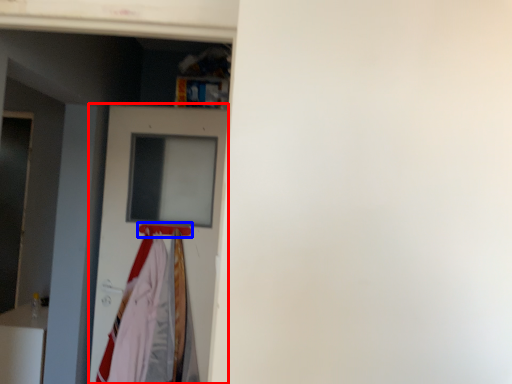
Question: Which object is further to the camera taking this photo, door (highlighted by a red box) or hanger (highlighted by a blue box)?

Choices:
 (A) door
 (B) hanger

Answer: (B)